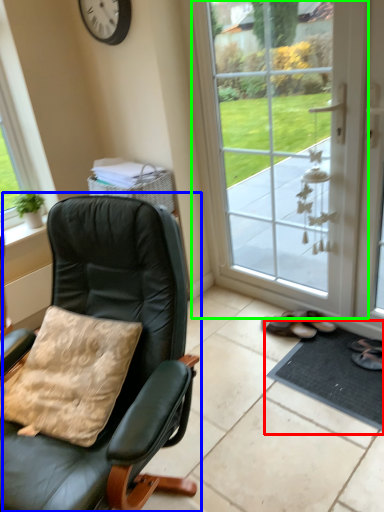
Question: Based on their relative distances, which object is farther from doormat (highlighted by a red box)? Choose from chair (highlighted by a blue box) and door (highlighted by a green box).

Choices:
 (A) chair
 (B) door

Answer: (A)